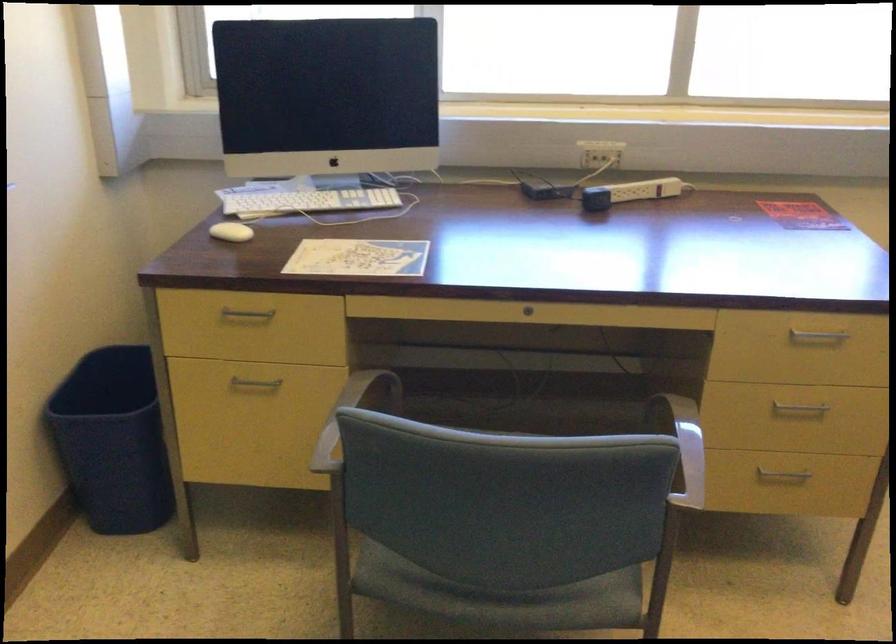
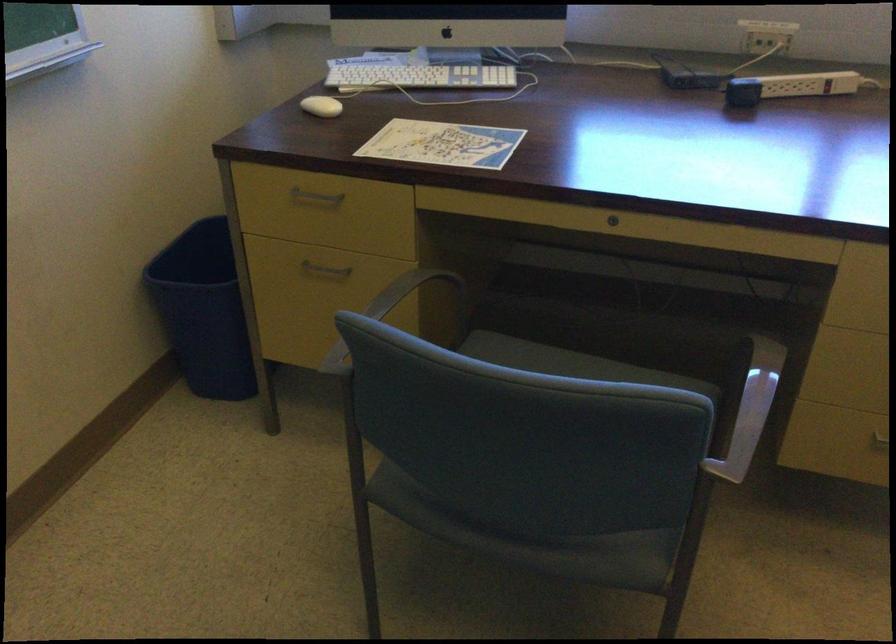
Find the pixel in the second image that matches (x=691, y=451) in the first image.

(750, 410)